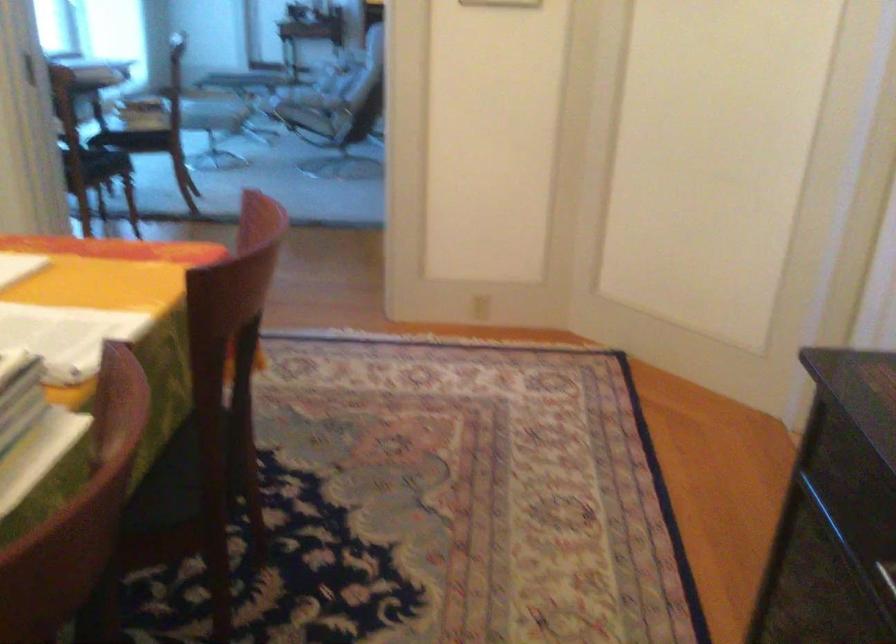
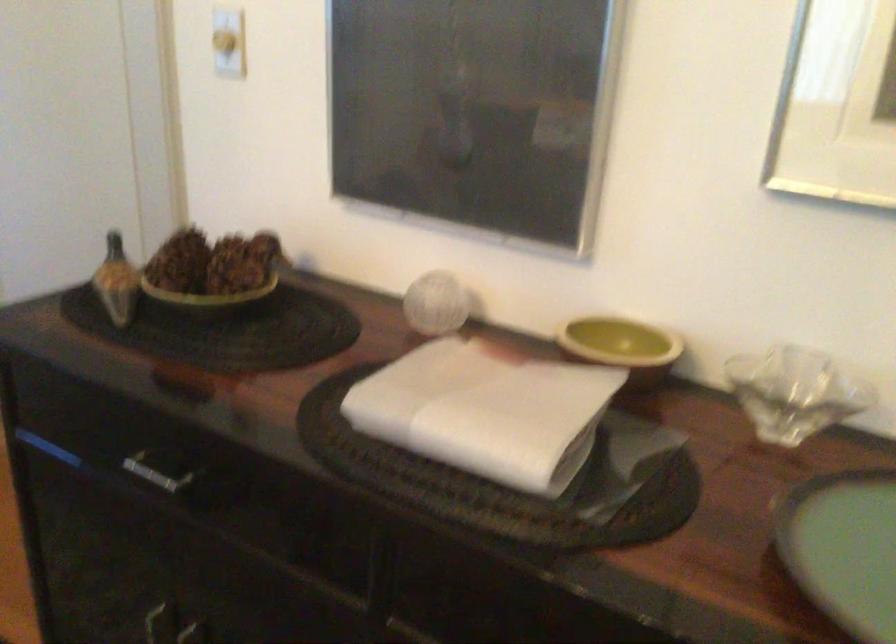
Question: The camera is either moving clockwise (left) or counter-clockwise (right) around the object. The first image is from the beginning of the video and the second image is from the end. Is the camera moving left or right when shooting the video?

Choices:
 (A) Left
 (B) Right

Answer: (A)